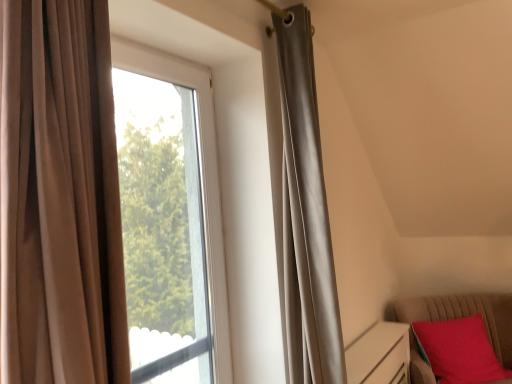
Question: Relative to transparent glass window at center, is velvet red cushion at lower right in front or behind?

Choices:
 (A) behind
 (B) front

Answer: (A)

Question: Is point (400, 314) positioned closer to the camera than point (210, 152)?

Choices:
 (A) closer
 (B) farther

Answer: (B)

Question: Considering the positions of velvet red cushion at lower right and transparent glass window at center in the image, is velvet red cushion at lower right wider or thinner than transparent glass window at center?

Choices:
 (A) thin
 (B) wide

Answer: (B)

Question: From a real-world perspective, relative to velvet red cushion at lower right, is transparent glass window at center vertically above or below?

Choices:
 (A) below
 (B) above

Answer: (B)

Question: Do you think transparent glass window at center is within velvet red cushion at lower right, or outside of it?

Choices:
 (A) inside
 (B) outside

Answer: (B)

Question: In the image, is transparent glass window at center on the left side or the right side of velvet red cushion at lower right?

Choices:
 (A) right
 (B) left

Answer: (B)

Question: Relative to velvet red cushion at lower right, is transparent glass window at center in front or behind?

Choices:
 (A) front
 (B) behind

Answer: (A)